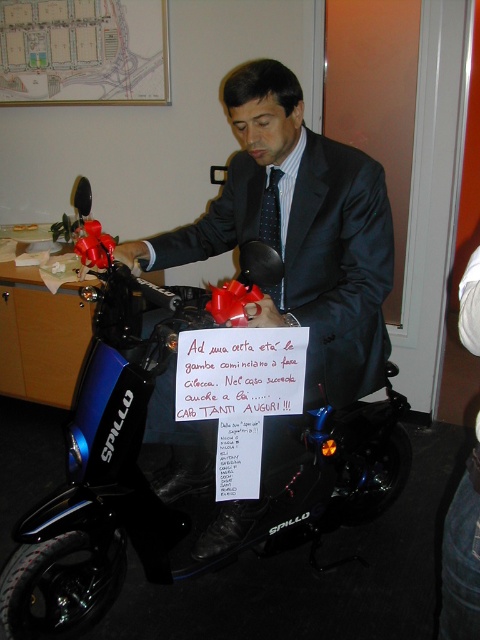
Between blue glossy scooter at center and white paper sign at center, which one appears on the left side from the viewer's perspective?

white paper sign at center is more to the left.

Which is more to the right, blue glossy scooter at center or white paper sign at center?

Positioned to the right is blue glossy scooter at center.

Is point (365, 432) closer to camera compared to point (280, 413)?

No, (365, 432) is further to viewer.

You are a GUI agent. You are given a task and a screenshot of the screen. Output one action in this format:
    pyautogui.click(x=<x>, y=<y>)
    Task: Click on the blue glossy scooter at center
    
    Given the screenshot: What is the action you would take?
    pyautogui.click(x=110, y=448)

Image resolution: width=480 pixels, height=640 pixels. I want to click on white paper sign at center, so pyautogui.click(x=240, y=372).

The height and width of the screenshot is (640, 480). Describe the element at coordinates (300, 232) in the screenshot. I see `shiny black suit at center` at that location.

Does shiny black suit at center appear over black dotted tie at center?

Incorrect, shiny black suit at center is not positioned above black dotted tie at center.

Between point (385, 284) and point (264, 200), which one is positioned in front?

Point (385, 284) is in front.

Identify the location of shiny black suit at center. This screenshot has width=480, height=640. (300, 232).